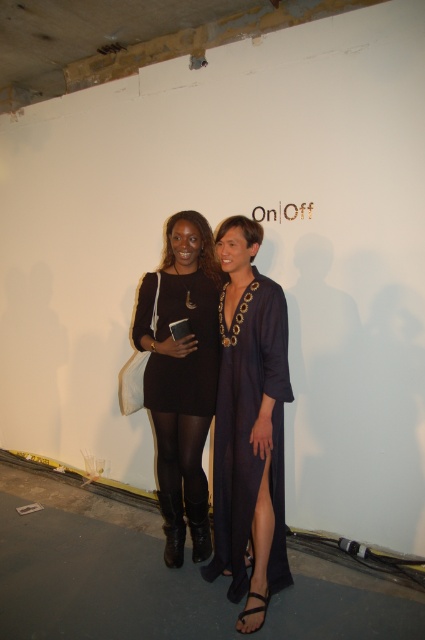
Question: In this image, where is matte black dress at center located relative to black leather boots at lower center?

Choices:
 (A) below
 (B) above

Answer: (B)

Question: Is black matte dress at center behind black leather boots at lower center?

Choices:
 (A) yes
 (B) no

Answer: (B)

Question: Where is matte black dress at center located in relation to black matte dress at center in the image?

Choices:
 (A) below
 (B) above

Answer: (A)

Question: Which of the following is the closest to the observer?

Choices:
 (A) (277, 573)
 (B) (161, 436)

Answer: (A)

Question: Considering the real-world distances, which object is closest to the navy satin dress at center?

Choices:
 (A) black leather boots at lower center
 (B) matte black dress at center
 (C) black matte dress at center

Answer: (B)

Question: Which of these objects is positioned farthest from the navy satin dress at center?

Choices:
 (A) black matte dress at center
 (B) matte black dress at center
 (C) black leather boots at lower center

Answer: (A)